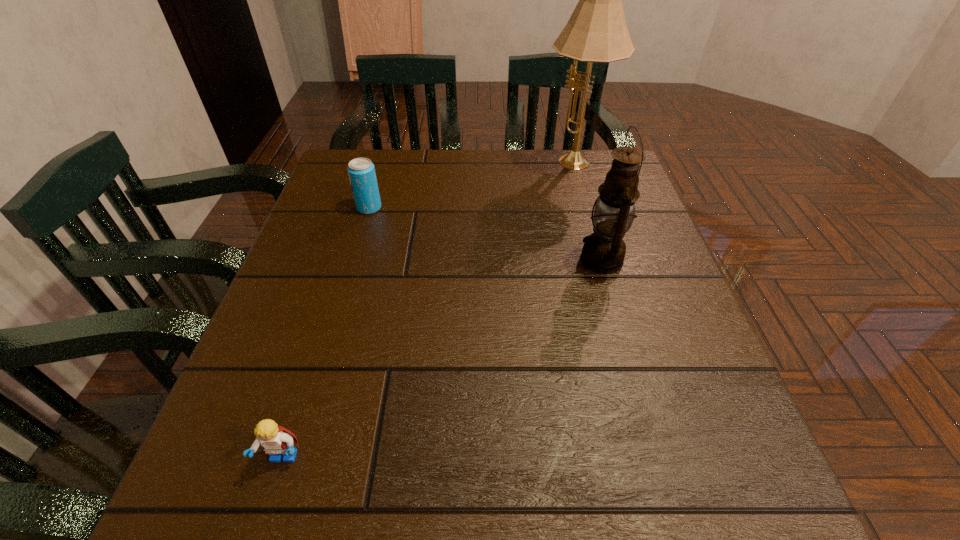
Image resolution: width=960 pixels, height=540 pixels. Identify the location of vacant point located between the Lego and the second nearest object. (443, 359).

At what (x,y) coordinates should I click in order to perform the action: click on vacant area between the tallest object and the second tallest object. Please return your answer as a coordinate pair (x, y). The image size is (960, 540). Looking at the image, I should click on (588, 212).

The image size is (960, 540). In order to click on free space between the third tallest object and the Lego in this screenshot , I will do pos(326,333).

Identify the location of vacant area between the shortest object and the farthest object. This screenshot has height=540, width=960. (428, 312).

Identify the location of unoccupied area between the lampshade and the second shortest object. (471, 186).

Where is `empty space between the third farthest object and the third tallest object`? empty space between the third farthest object and the third tallest object is located at coordinates (485, 234).

This screenshot has width=960, height=540. Identify the location of the closest object to the tallest object. (603, 251).

At what (x,y) coordinates should I click in order to perform the action: click on object that is the second closest one to the soda can. Please return your answer as a coordinate pair (x, y). The width and height of the screenshot is (960, 540). Looking at the image, I should click on (603, 251).

Identify the location of vacant space that satisfies the following two spatial constraints: 1. on the back side of the soda can; 2. on the left side of the lampshade. This screenshot has height=540, width=960. (382, 165).